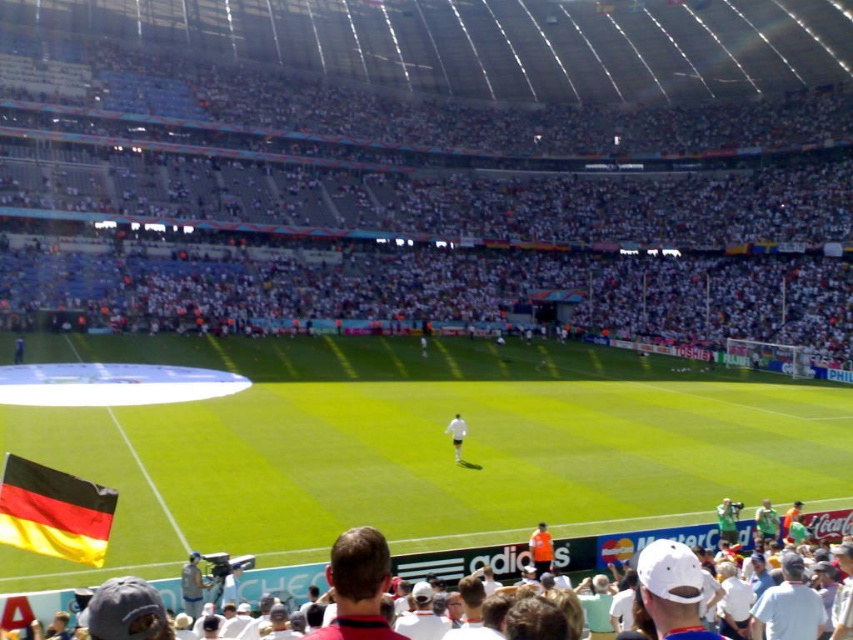
You are a photographer trying to capture a clear shot of the orange jersey at center without the black and yellow fabric flag at lower left overlapping it. Based on their positions, is this possible?

The black and yellow fabric flag at lower left might be wider than orange jersey at center, so there is a possibility of overlap. Adjust your position to ensure the flag does not block the jersey.

You are a photographer at the soccer stadium and want to capture a photo of both the white matte shirt at center and the orange jersey at center. Which player should be on the left side in the photo?

The orange jersey at center should be on the left side in the photo because the white matte shirt at center is positioned on the right side of orange jersey at center.

You are a photographer positioned at the edge of the soccer field. You want to take a photo that includes both the white matte shirt at center and the orange jersey at center. Which player should you focus on first to ensure they are in the foreground?

The white matte shirt at center has a lesser height compared to orange jersey at center, so you should focus on the orange jersey at center first as it is taller and would be more prominent in the foreground.